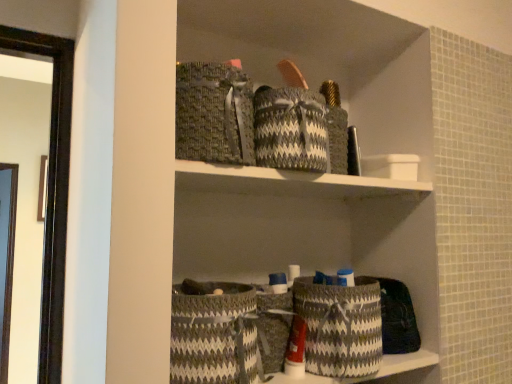
Question: Is gray woven basket at center, placed as the 2th basket when sorted from right to left, smaller than gray woven basket at lower center, the 1th basket in the right-to-left sequence?

Choices:
 (A) no
 (B) yes

Answer: (B)

Question: From the image's perspective, is gray woven basket at center, marked as the 2th basket in a left-to-right arrangement, over gray woven basket at lower center, which is the third basket from left to right?

Choices:
 (A) yes
 (B) no

Answer: (B)

Question: From the image's perspective, does gray woven basket at center, marked as the 2th basket in a left-to-right arrangement, appear lower than gray woven basket at lower center, the 1th basket in the right-to-left sequence?

Choices:
 (A) yes
 (B) no

Answer: (A)

Question: Is gray woven basket at center, placed as the 2th basket when sorted from right to left, oriented towards gray woven basket at lower center, which is the third basket from left to right?

Choices:
 (A) yes
 (B) no

Answer: (B)

Question: Can you confirm if gray woven basket at center, placed as the 2th basket when sorted from right to left, is positioned to the left of gray woven basket at lower center, which is the third basket from left to right?

Choices:
 (A) yes
 (B) no

Answer: (A)

Question: Would you say gray woven basket at lower center, the 1th basket in the right-to-left sequence, is to the left or to the right of gray woven basket at lower center, placed as the first basket when sorted from left to right, in the picture?

Choices:
 (A) left
 (B) right

Answer: (B)

Question: Is gray woven basket at lower center, the 1th basket in the right-to-left sequence, in front of or behind gray woven basket at lower center, which is the 3th basket in right-to-left order, in the image?

Choices:
 (A) front
 (B) behind

Answer: (B)

Question: Looking at the image, does gray woven basket at lower center, which is the third basket from left to right, seem bigger or smaller compared to gray woven basket at lower center, which is the 3th basket in right-to-left order?

Choices:
 (A) big
 (B) small

Answer: (B)

Question: From the image's perspective, is gray woven basket at lower center, which is the third basket from left to right, above or below gray woven basket at lower center, which is the 3th basket in right-to-left order?

Choices:
 (A) below
 (B) above

Answer: (A)

Question: Is gray woven basket at lower center, which is the 3th basket in right-to-left order, to the left or to the right of gray woven basket at center, placed as the 2th basket when sorted from right to left, in the image?

Choices:
 (A) left
 (B) right

Answer: (A)

Question: Looking at their shapes, would you say gray woven basket at lower center, placed as the first basket when sorted from left to right, is wider or thinner than gray woven basket at center, marked as the 2th basket in a left-to-right arrangement?

Choices:
 (A) thin
 (B) wide

Answer: (B)

Question: Is gray woven basket at lower center, which is the 3th basket in right-to-left order, in front of or behind gray woven basket at center, marked as the 2th basket in a left-to-right arrangement, in the image?

Choices:
 (A) behind
 (B) front

Answer: (B)

Question: Considering the positions of gray woven basket at lower center, placed as the first basket when sorted from left to right, and gray woven basket at center, marked as the 2th basket in a left-to-right arrangement, in the image, is gray woven basket at lower center, placed as the first basket when sorted from left to right, bigger or smaller than gray woven basket at center, marked as the 2th basket in a left-to-right arrangement,?

Choices:
 (A) small
 (B) big

Answer: (B)

Question: Looking at the image, does gray woven basket at lower center, which is the third basket from left to right, seem bigger or smaller compared to gray woven basket at center, placed as the 2th basket when sorted from right to left?

Choices:
 (A) small
 (B) big

Answer: (B)

Question: In terms of width, does gray woven basket at lower center, which is the third basket from left to right, look wider or thinner when compared to gray woven basket at center, marked as the 2th basket in a left-to-right arrangement?

Choices:
 (A) thin
 (B) wide

Answer: (B)